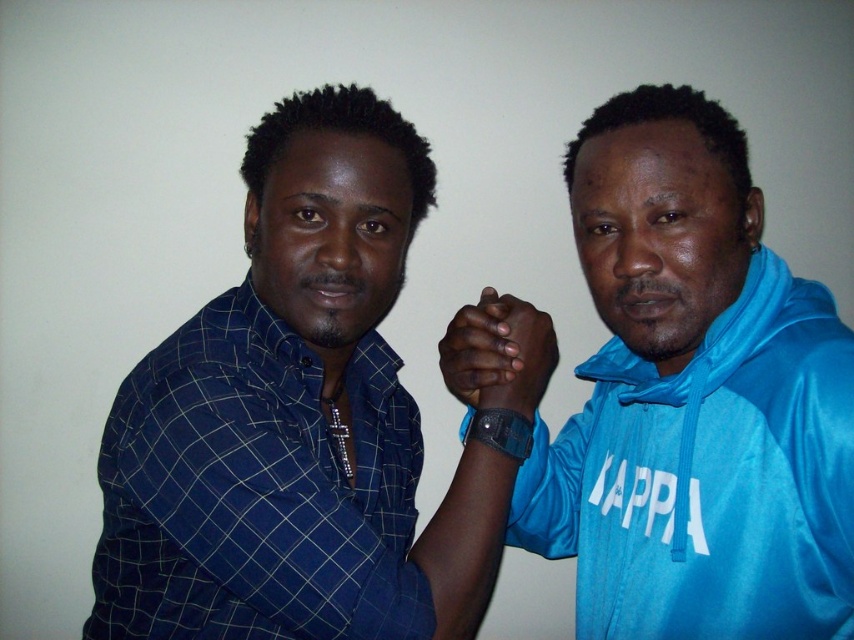
Question: Among these objects, which one is nearest to the camera?

Choices:
 (A) blue checkered shirt at left
 (B) dark skin hand at center
 (C) blue satin hoodie at center

Answer: (C)

Question: Is blue checkered shirt at left positioned in front of dark skin hand at center?

Choices:
 (A) yes
 (B) no

Answer: (A)

Question: Which of these objects is positioned closest to the dark skin hand at center?

Choices:
 (A) blue satin hoodie at center
 (B) blue checkered shirt at left

Answer: (A)

Question: Considering the relative positions of blue checkered shirt at left and blue satin hoodie at center in the image provided, where is blue checkered shirt at left located with respect to blue satin hoodie at center?

Choices:
 (A) left
 (B) right

Answer: (A)

Question: Which of the following is the farthest from the observer?

Choices:
 (A) blue satin hoodie at center
 (B) dark skin hand at center

Answer: (B)

Question: Is blue satin hoodie at center smaller than dark skin hand at center?

Choices:
 (A) yes
 (B) no

Answer: (B)